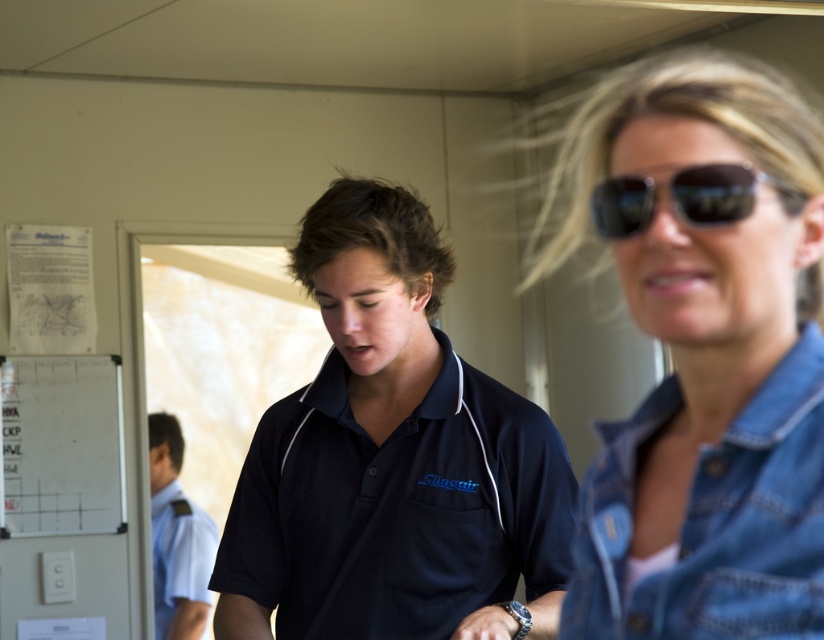
You are an observer in the scene. You see the denim jacket at upper right and the light blue uniform at lower left. Which one appears larger in size?

The denim jacket at upper right is bigger than the light blue uniform at lower left.

You are an event organizer who needs to arrange seating based on the height of the participants. You observe the black cotton polo shirt at center and the light blue uniform at lower left in the image. Which participant should you seat first if you want to seat the taller one closer to the front?

The light blue uniform at lower left is taller than the black cotton polo shirt at center, so you should seat the participant in the light blue uniform at lower left first to place the taller one closer to the front.